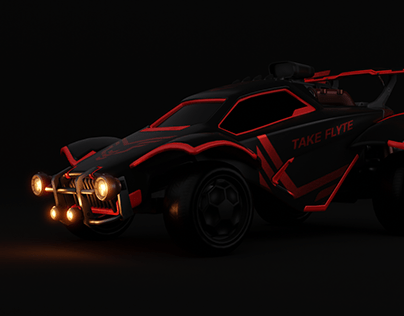
You are a GUI agent. You are given a task and a screenshot of the screen. Output one action in this format:
    pyautogui.click(x=<x>, y=<y>)
    Task: Click on the hood
    The width and height of the screenshot is (404, 316).
    Given the screenshot: What is the action you would take?
    pyautogui.click(x=375, y=70), pyautogui.click(x=119, y=154)